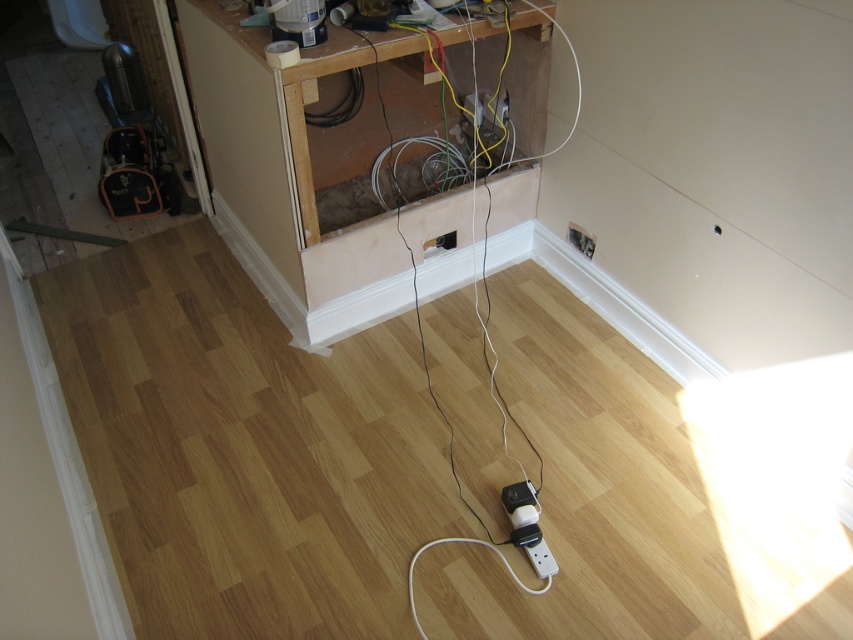
You are an electrician working in this room and need to connect two devices to the outlets. The first device requires an outlet that is closer to the exposed wall section. Which outlet should you choose between the white plastic electric outlet at lower right and the white plastic electric outlet at center?

The white plastic electric outlet at lower right is closer to the exposed wall section than the white plastic electric outlet at center because it is positioned lower and near the base of the wall where the electrical work is concentrated. However, according to the provided description, the distance between them is 37.07 centimeters, but the exact proximity to the exposed wall isn not specified. Therefore, based solely on their positions, the outlet at lower right is likely closer.

You are an electrician working on the exposed wall in the room. You need to connect a new cable to the outlet that is farther to the right. Which outlet should you choose between the white plastic electric outlet at lower right and the white plastic electric outlet at center?

You should choose the white plastic electric outlet at lower right because it is positioned to the right of the white plastic electric outlet at center, making it the one farther to the right.

You are an electrician working in the room and need to connect a new device. You have two outlets available. Which outlet is more suitable for a device that requires a thicker plug? Please choose between the white plastic electric outlet at lower right and the white plastic electric outlet at center.

The white plastic electric outlet at center is more suitable for a device that requires a thicker plug because it is thicker than the white plastic electric outlet at lower right.